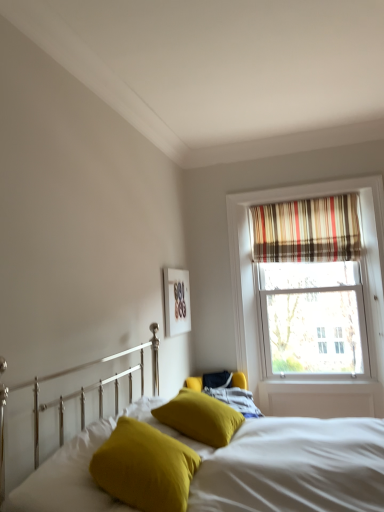
Question: Is the position of mustard yellow fabric pillow at lower center, which ranks as the second pillow in left-to-right order, more distant than that of striped fabric curtain at upper right?

Choices:
 (A) yes
 (B) no

Answer: (B)

Question: Is mustard yellow fabric pillow at lower center, which ranks as the second pillow in left-to-right order, not near striped fabric curtain at upper right?

Choices:
 (A) yes
 (B) no

Answer: (A)

Question: Can you confirm if mustard yellow fabric pillow at lower center, which ranks as the second pillow in right-to-left order, is bigger than striped fabric curtain at upper right?

Choices:
 (A) no
 (B) yes

Answer: (A)

Question: Is mustard yellow fabric pillow at lower center, which ranks as the second pillow in left-to-right order, to the left of striped fabric curtain at upper right from the viewer's perspective?

Choices:
 (A) yes
 (B) no

Answer: (A)

Question: Is mustard yellow fabric pillow at lower center, which ranks as the second pillow in left-to-right order, aimed at striped fabric curtain at upper right?

Choices:
 (A) no
 (B) yes

Answer: (A)

Question: Considering the relative sizes of mustard yellow fabric pillow at lower center, which ranks as the second pillow in left-to-right order, and striped fabric curtain at upper right in the image provided, is mustard yellow fabric pillow at lower center, which ranks as the second pillow in left-to-right order, wider than striped fabric curtain at upper right?

Choices:
 (A) yes
 (B) no

Answer: (A)

Question: Would you say matte white picture frame at upper center is a long distance from mustard yellow fabric pillow at lower center, which ranks as the second pillow in left-to-right order?

Choices:
 (A) no
 (B) yes

Answer: (B)

Question: From a real-world perspective, is matte white picture frame at upper center under mustard yellow fabric pillow at lower center, which ranks as the second pillow in left-to-right order?

Choices:
 (A) no
 (B) yes

Answer: (A)

Question: Is matte white picture frame at upper center shorter than mustard yellow fabric pillow at lower center, which ranks as the second pillow in left-to-right order?

Choices:
 (A) no
 (B) yes

Answer: (A)

Question: Considering the relative positions of matte white picture frame at upper center and mustard yellow fabric pillow at lower center, which ranks as the second pillow in left-to-right order, in the image provided, is matte white picture frame at upper center to the left of mustard yellow fabric pillow at lower center, which ranks as the second pillow in left-to-right order, from the viewer's perspective?

Choices:
 (A) yes
 (B) no

Answer: (B)

Question: Does matte white picture frame at upper center have a greater height compared to mustard yellow fabric pillow at lower center, which ranks as the second pillow in left-to-right order?

Choices:
 (A) no
 (B) yes

Answer: (B)

Question: Is mustard yellow fabric pillow at lower center, which ranks as the second pillow in left-to-right order, inside matte white picture frame at upper center?

Choices:
 (A) yes
 (B) no

Answer: (B)

Question: Is mustard yellow fabric pillow at lower center, which ranks as the second pillow in right-to-left order, closer to the viewer compared to matte white picture frame at upper center?

Choices:
 (A) no
 (B) yes

Answer: (B)